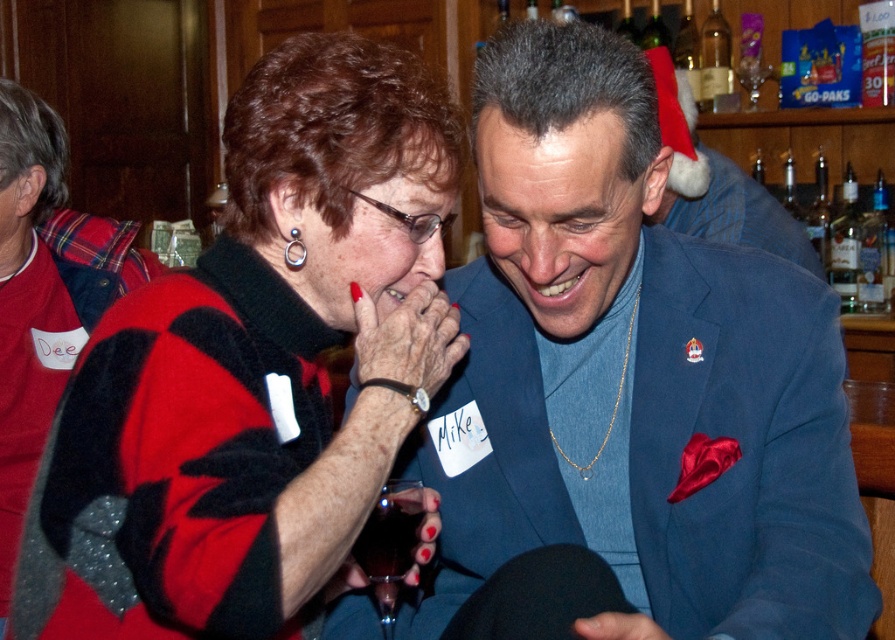
Is red/black sweater at center above transparent glass at lower center?

Indeed, red/black sweater at center is positioned over transparent glass at lower center.

Is red/black sweater at center to the left of transparent glass at lower center from the viewer's perspective?

Yes, red/black sweater at center is to the left of transparent glass at lower center.

Which is behind, point (163, 580) or point (378, 515)?

Positioned behind is point (378, 515).

The image size is (895, 640). In order to click on red/black sweater at center in this screenshot , I will do `click(254, 368)`.

Who is higher up, blue satin suit at center or red/black sweater at center?

red/black sweater at center is higher up.

Does point (736, 305) lie in front of point (154, 634)?

No.

Which is behind, point (527, 195) or point (312, 83)?

Point (527, 195)

Where is `blue satin suit at center`? blue satin suit at center is located at coordinates (634, 376).

In the scene shown: Between blue satin suit at center and transparent glass at lower center, which one has less height?

With less height is transparent glass at lower center.

Who is higher up, blue satin suit at center or transparent glass at lower center?

blue satin suit at center

Identify the location of blue satin suit at center. (634, 376).